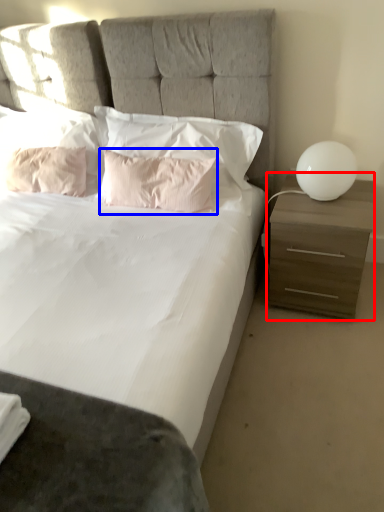
Question: Among these objects, which one is farthest to the camera, nightstand (highlighted by a red box) or pillow (highlighted by a blue box)?

Choices:
 (A) nightstand
 (B) pillow

Answer: (B)